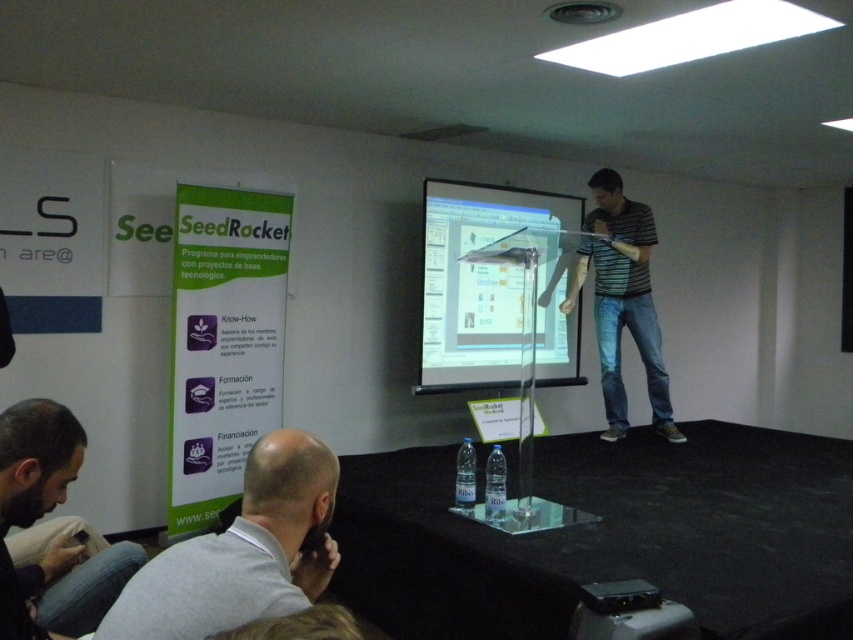
Does point (293, 449) come closer to viewer compared to point (495, 268)?

Yes, it is.

Between gray cotton shirt at lower left and transparent glass projection screen at center, which one appears on the left side from the viewer's perspective?

gray cotton shirt at lower left is more to the left.

Does point (161, 577) come behind point (460, 216)?

No, (161, 577) is in front of (460, 216).

The width and height of the screenshot is (853, 640). I want to click on gray cotton shirt at lower left, so click(x=241, y=552).

Does transparent glass projection screen at center appear on the left side of dark brown leather jacket at lower left?

No, transparent glass projection screen at center is not to the left of dark brown leather jacket at lower left.

You are a GUI agent. You are given a task and a screenshot of the screen. Output one action in this format:
    pyautogui.click(x=<x>, y=<y>)
    Task: Click on the transparent glass projection screen at center
    The width and height of the screenshot is (853, 640).
    Given the screenshot: What is the action you would take?
    pyautogui.click(x=476, y=280)

Locate an element on the screen. This screenshot has width=853, height=640. transparent glass projection screen at center is located at coordinates (476, 280).

Which is above, gray cotton shirt at lower left or striped cotton shirt at center?

striped cotton shirt at center

What do you see at coordinates (241, 552) in the screenshot?
I see `gray cotton shirt at lower left` at bounding box center [241, 552].

At what (x,y) coordinates should I click in order to perform the action: click on gray cotton shirt at lower left. Please return your answer as a coordinate pair (x, y). The image size is (853, 640). Looking at the image, I should click on (241, 552).